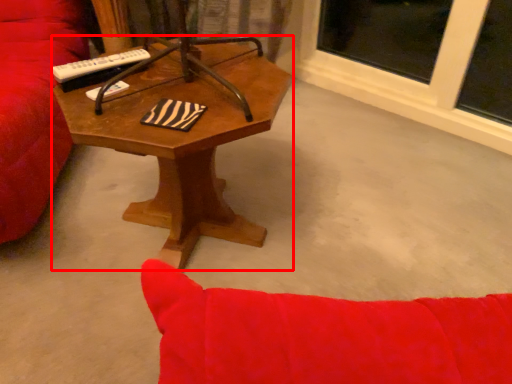
Question: From the image's perspective, where is coffee table (annotated by the red box) located in relation to remote control in the image?

Choices:
 (A) below
 (B) above

Answer: (A)